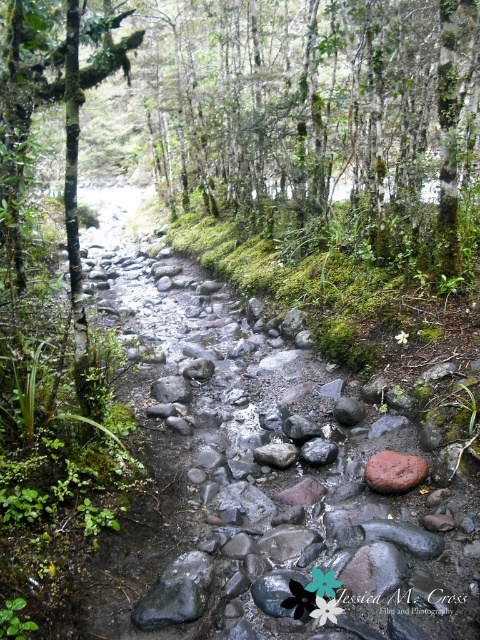
Question: Is gray smooth rock at center to the left of smooth gray rock at center from the viewer's perspective?

Choices:
 (A) no
 (B) yes

Answer: (B)

Question: Is green mossy tree at upper center positioned behind smooth gray rock at center?

Choices:
 (A) no
 (B) yes

Answer: (B)

Question: Can you confirm if gray smooth rock at center is positioned below smooth gray rock at center?

Choices:
 (A) no
 (B) yes

Answer: (B)

Question: Which point is farther to the camera?

Choices:
 (A) smooth gray rock at center
 (B) green mossy tree at upper center

Answer: (B)

Question: Which is farther from the smooth gray rock at center?

Choices:
 (A) green mossy tree at upper center
 (B) gray smooth rock at center

Answer: (A)

Question: Which of the following is the closest to the observer?

Choices:
 (A) [352, 61]
 (B) [266, 460]

Answer: (B)